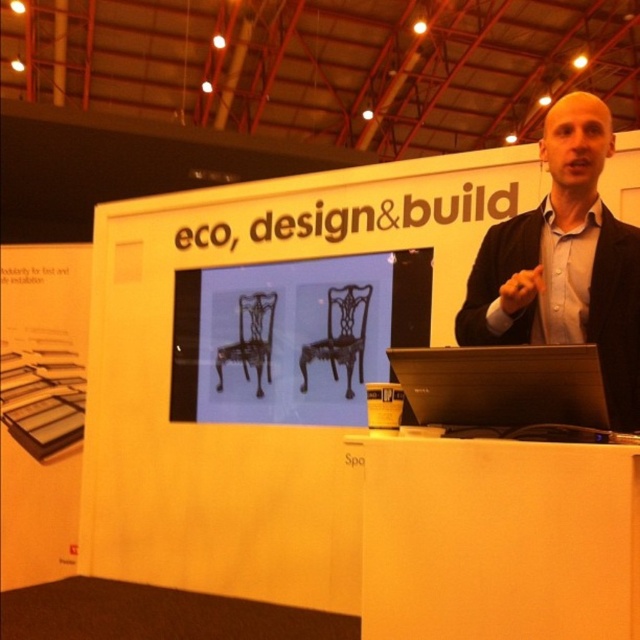
You are an attendee at the presentation. You want to move from your seat to the podium to ask a question. The shortest path requires passing between the black wrought iron chairs at center and the black suit at upper right. Can you walk through this path without any obstruction?

The black wrought iron chairs at center is 5.45 feet away from black suit at upper right. Since the distance is more than 5 feet, you can walk through the path between them without any obstruction.

You are an event organizer who needs to move a 1.5 meter wide stage prop from the side to the front. The path between the black wrought iron chairs at center and the black matte laptop at center is your only route. Will the prop fit through the space between them?

The distance between the black wrought iron chairs at center and the black matte laptop at center is 1.84 meters. Since the prop is 1.5 meters wide, it will fit through the space as the distance is wider than the prop.

You are an attendee at the presentation. The presenter is wearing a black suit at upper right and there is a black matte laptop at center on the podium. Which object is positioned more to the right side of the podium?

The black suit at upper right is positioned more to the right side of the podium compared to the black matte laptop at center.